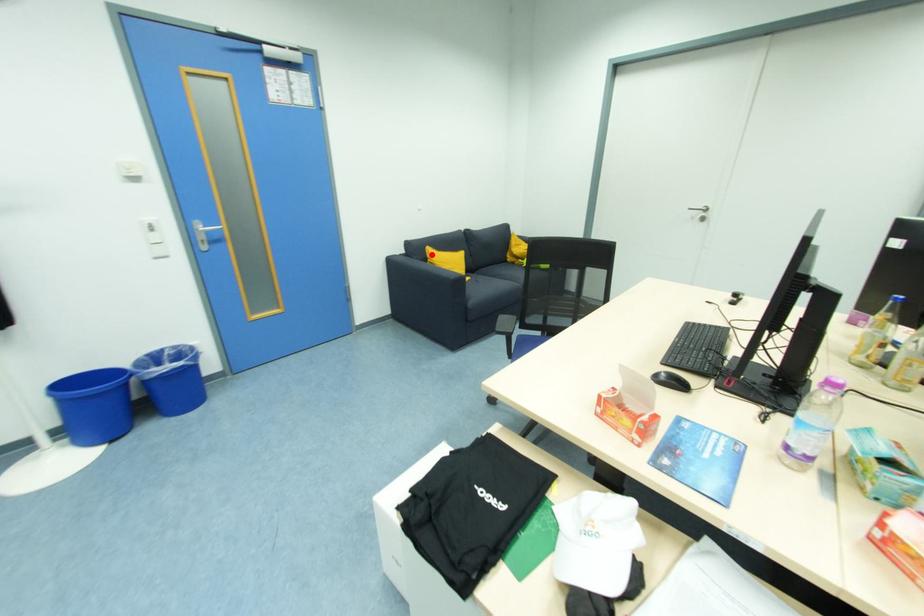
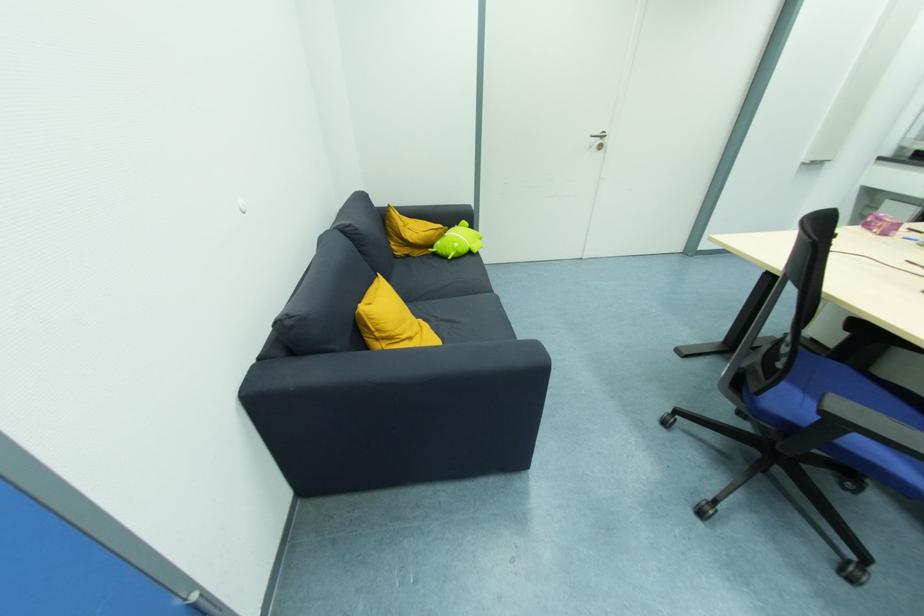
The point at the highlighted location is marked in the first image. Where is the corresponding point in the second image?

(372, 321)